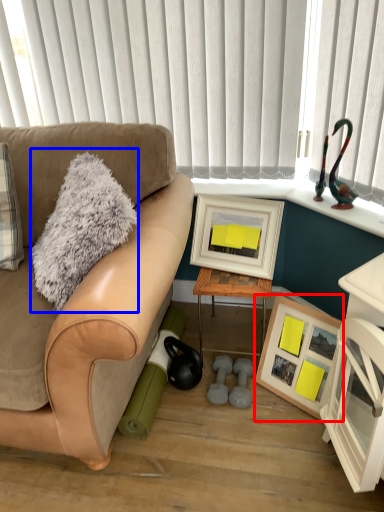
Question: Which object appears farthest to the camera in this image, picture frame (highlighted by a red box) or throw pillow (highlighted by a blue box)?

Choices:
 (A) picture frame
 (B) throw pillow

Answer: (A)